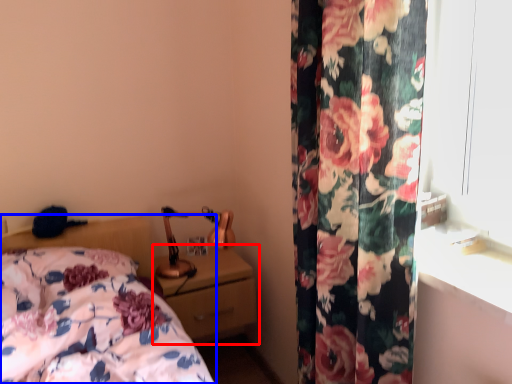
Question: Which of the following is the closest to the observer, nightstand (highlighted by a red box) or bed (highlighted by a blue box)?

Choices:
 (A) nightstand
 (B) bed

Answer: (B)